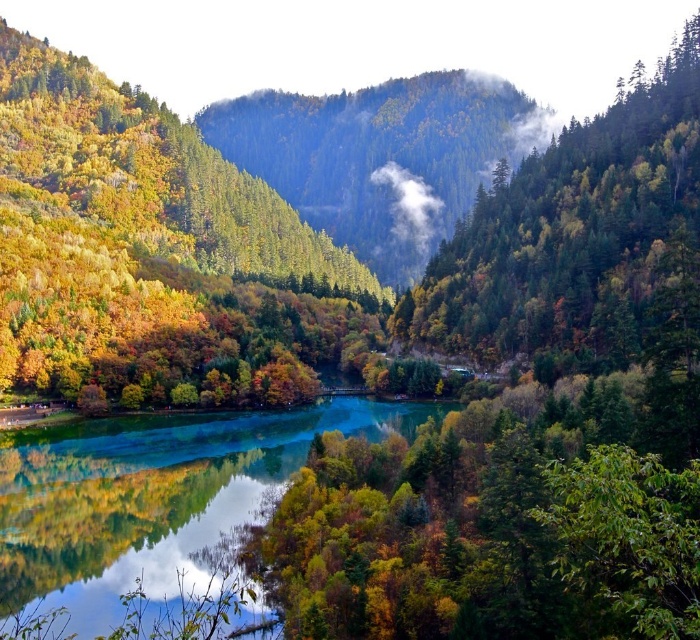
Question: Considering the real-world distances, which object is closest to the green matte forest at center?

Choices:
 (A) green forested mountain at center
 (B) green reflective water at center

Answer: (B)

Question: Can you confirm if green reflective water at center is bigger than green forested mountain at center?

Choices:
 (A) no
 (B) yes

Answer: (A)

Question: In this image, where is green reflective water at center located relative to green matte forest at center?

Choices:
 (A) above
 (B) below

Answer: (B)

Question: Which of the following is the farthest from the observer?

Choices:
 (A) (217, 449)
 (B) (228, 125)

Answer: (B)

Question: Which object appears closest to the camera in this image?

Choices:
 (A) green reflective water at center
 (B) green matte forest at center

Answer: (A)

Question: Can you confirm if green reflective water at center is positioned below green forested mountain at center?

Choices:
 (A) no
 (B) yes

Answer: (B)